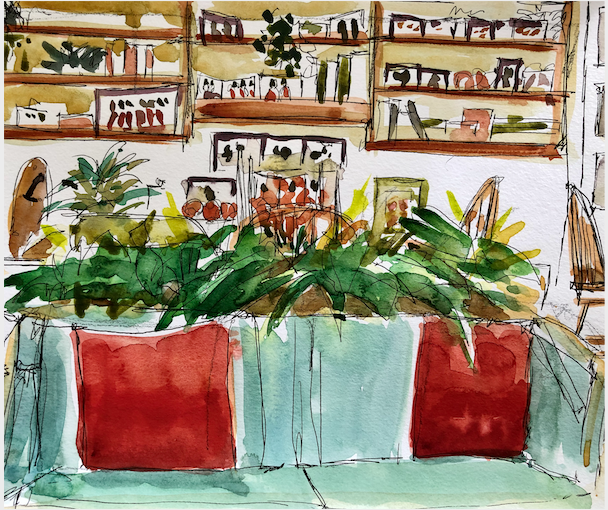
Locate an element on the screen. The height and width of the screenshot is (510, 608). 1 armrest on right is located at coordinates (568, 356).